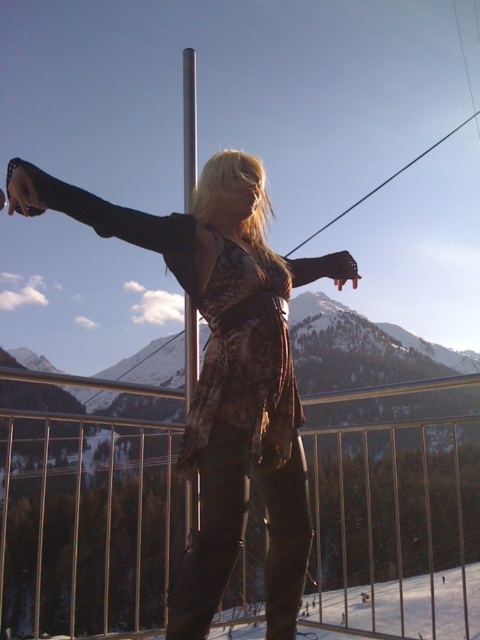
Is matte black dress at center to the right of silver metallic pole at center from the viewer's perspective?

Yes, matte black dress at center is to the right of silver metallic pole at center.

Who is more distant from viewer, (x=218, y=387) or (x=189, y=81)?

The point (x=189, y=81) is behind.

Describe the element at coordinates (224, 372) in the screenshot. I see `matte black dress at center` at that location.

The image size is (480, 640). I want to click on matte black dress at center, so click(224, 372).

Which is below, metallic silver railing at center or silver metallic pole at center?

metallic silver railing at center is below.

Consider the image. Is metallic silver railing at center above silver metallic pole at center?

Incorrect, metallic silver railing at center is not positioned above silver metallic pole at center.

Is point (443, 515) positioned after point (196, 355)?

Yes, it is behind point (196, 355).

The image size is (480, 640). I want to click on metallic silver railing at center, so click(396, 513).

Does metallic silver railing at center have a greater height compared to matte black dress at center?

Indeed, metallic silver railing at center has a greater height compared to matte black dress at center.

Who is more forward, (360,465) or (230,275)?

Positioned in front is point (230,275).

Where is `metallic silver railing at center`? This screenshot has height=640, width=480. metallic silver railing at center is located at coordinates (396, 513).